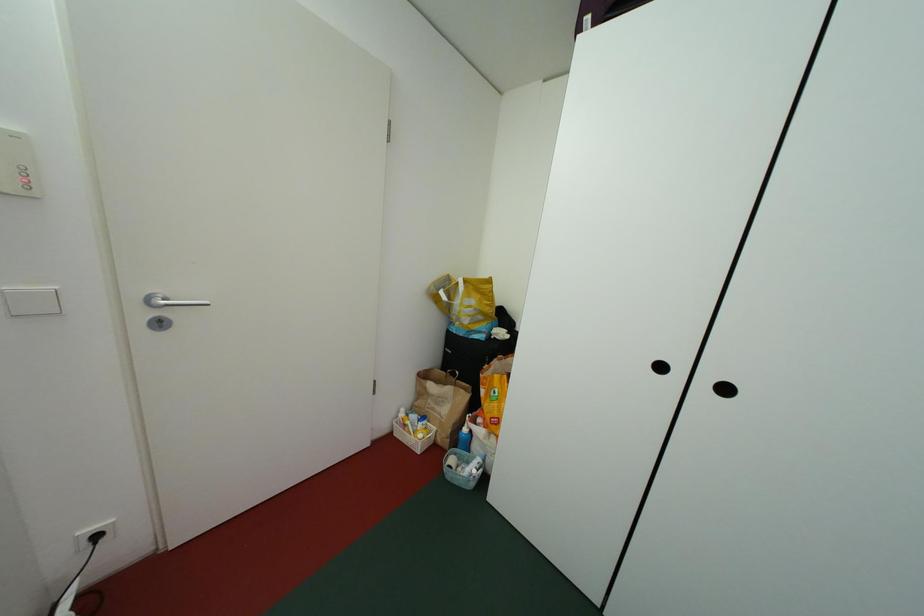
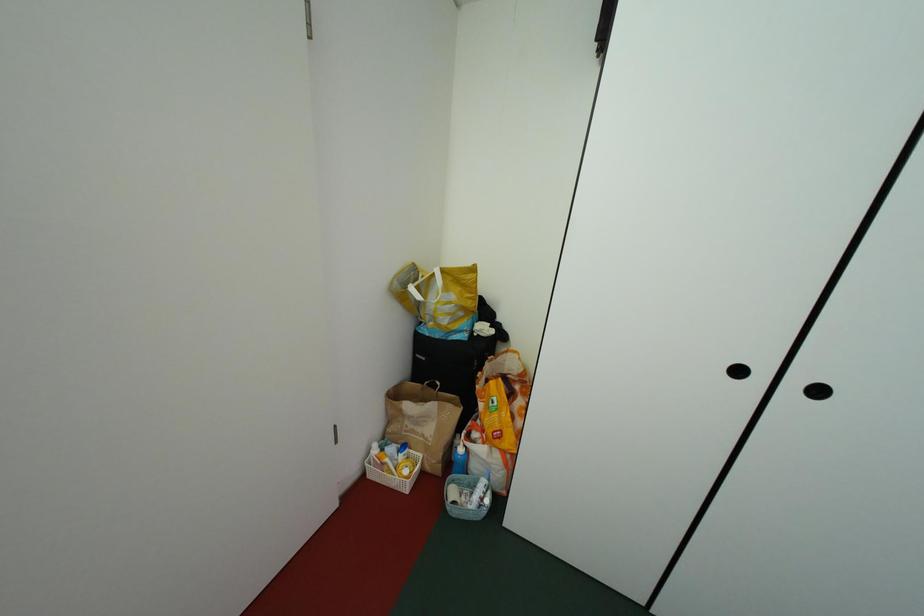
Question: How did the camera likely rotate?

Choices:
 (A) Left
 (B) Right
 (C) Up
 (D) Down

Answer: (B)